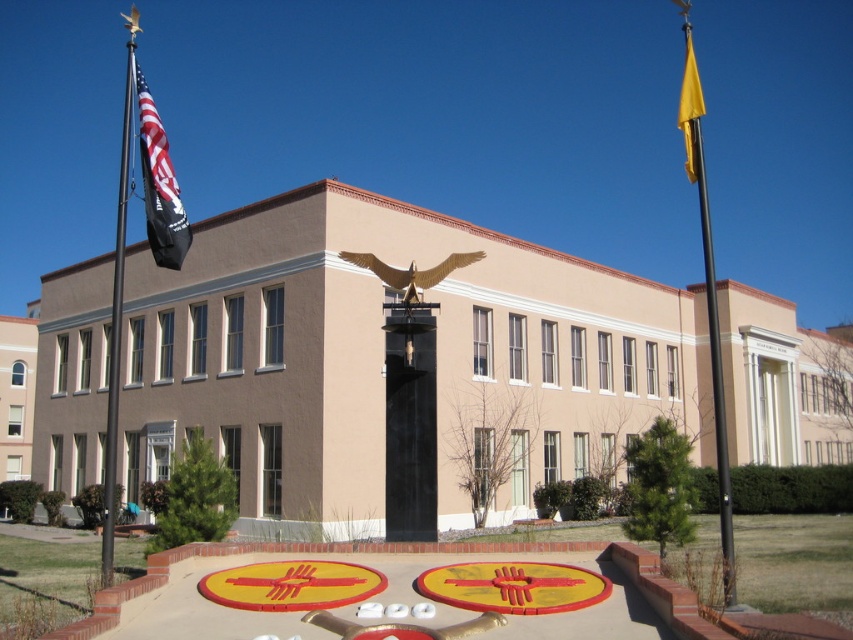
You are a photographer planning to capture a symmetrical shot of the building while ensuring both the black metal flag pole at upper right and the matte black flag at left are visible. Given their heights, which object will appear taller in your photo?

The black metal flag pole at upper right will appear taller in the photo because it has a greater height compared to the matte black flag at left.

You are a photographer standing in the courtyard in front of the beige building. You want to take a photo that includes both the black metal flag pole at left and the gold metallic eagle at center. Which object should you position closer to the camera to ensure both are visible in the frame?

The black metal flag pole at left should be positioned closer to the camera because it is over the gold metallic eagle at center, meaning it is closer to the viewer by default. By keeping it near, both objects will remain in the frame.